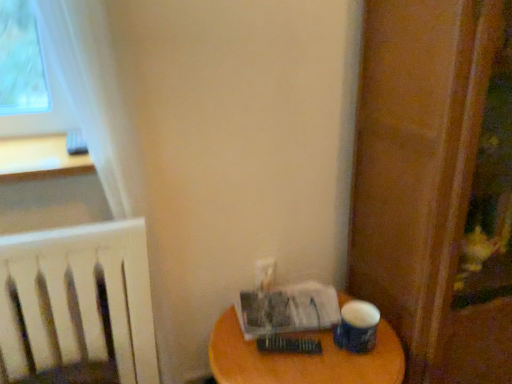
Identify the location of vacant space in front of white paper at lower right, arranged as the 2th paperback book when viewed from the front. The width and height of the screenshot is (512, 384). (289, 365).